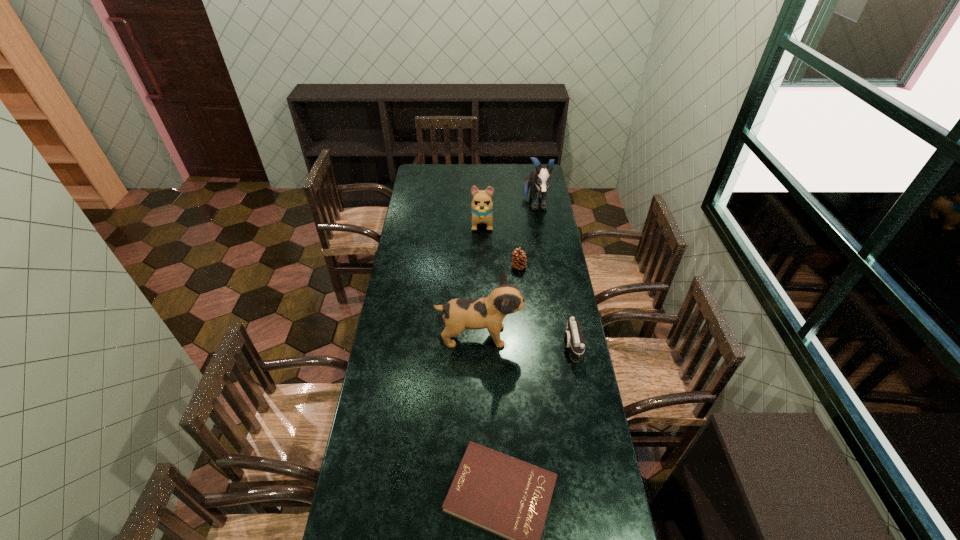
This screenshot has height=540, width=960. In order to click on vacant space located 0.230m on the front lens of the camera in this screenshot , I will do `click(506, 346)`.

I want to click on blank area located 0.070m on the front lens of the camera, so click(x=545, y=346).

Find the location of a particular element. puppy positioned at the right edge is located at coordinates (539, 179).

I want to click on camera at the right edge, so click(573, 338).

In the image, there is a desktop. Identify the location of free space at the left edge. Image resolution: width=960 pixels, height=540 pixels. (411, 219).

The width and height of the screenshot is (960, 540). Identify the location of free space at the right edge of the desktop. (608, 494).

This screenshot has height=540, width=960. I want to click on empty space that is in between the rightmost puppy and the camera, so click(553, 275).

Locate an element on the screen. This screenshot has height=540, width=960. free space between the camera and the rightmost puppy is located at coordinates (553, 275).

Find the location of a particular element. Image resolution: width=960 pixels, height=540 pixels. empty space that is in between the rightmost puppy and the camera is located at coordinates (553, 275).

At what (x,y) coordinates should I click in order to perform the action: click on empty space that is in between the camera and the rightmost puppy. Please return your answer as a coordinate pair (x, y). Looking at the image, I should click on (553, 275).